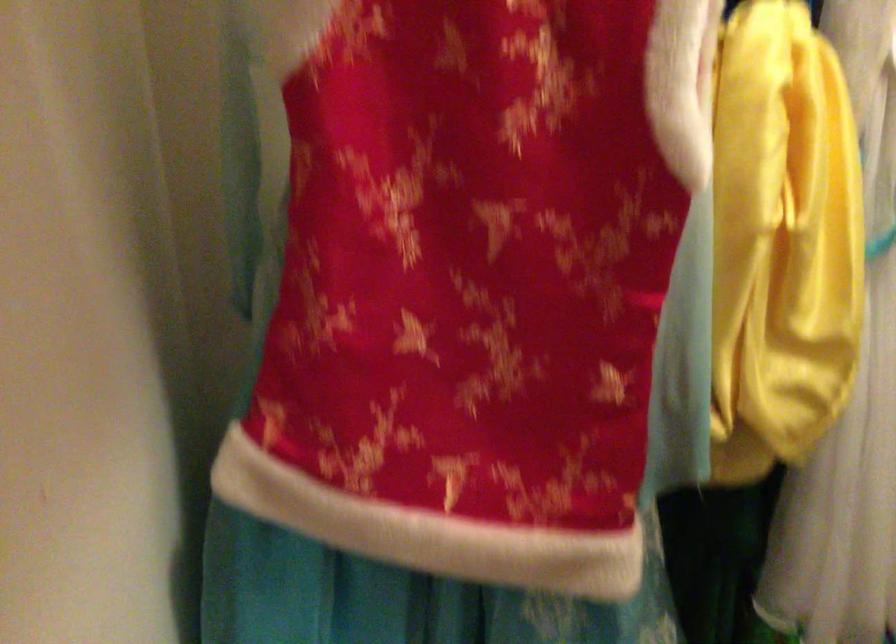
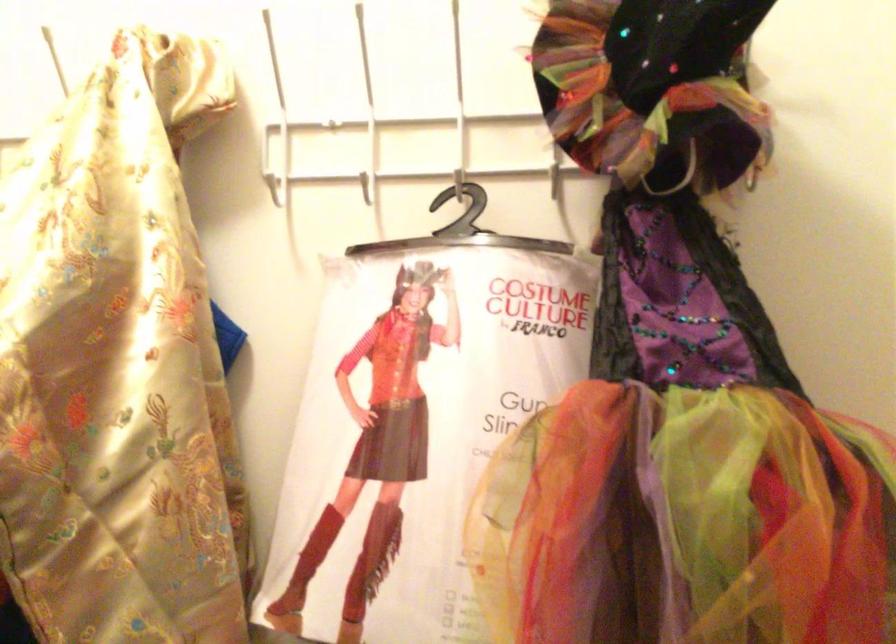
Question: In a continuous first-person perspective shot, in which direction is the camera moving?

Choices:
 (A) Left
 (B) Right
 (C) Forward
 (D) Backward

Answer: (B)